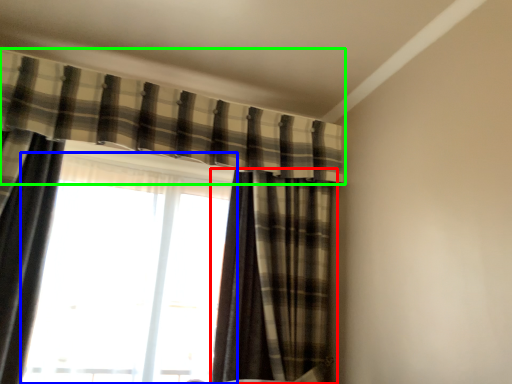
Question: Estimate the real-world distances between objects in this image. Which object is farther from curtain (highlighted by a red box), window (highlighted by a blue box) or curtain (highlighted by a green box)?

Choices:
 (A) window
 (B) curtain

Answer: (B)